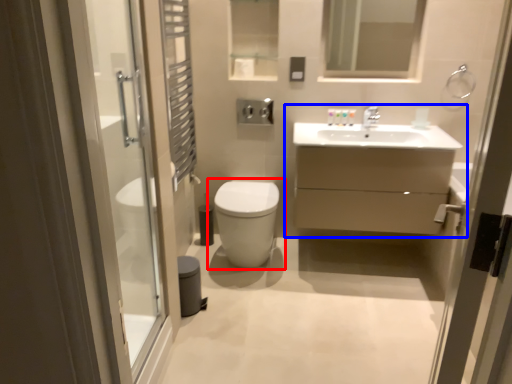
Question: Which object is further to the camera taking this photo, toilet (highlighted by a red box) or bathroom cabinet (highlighted by a blue box)?

Choices:
 (A) toilet
 (B) bathroom cabinet

Answer: (A)